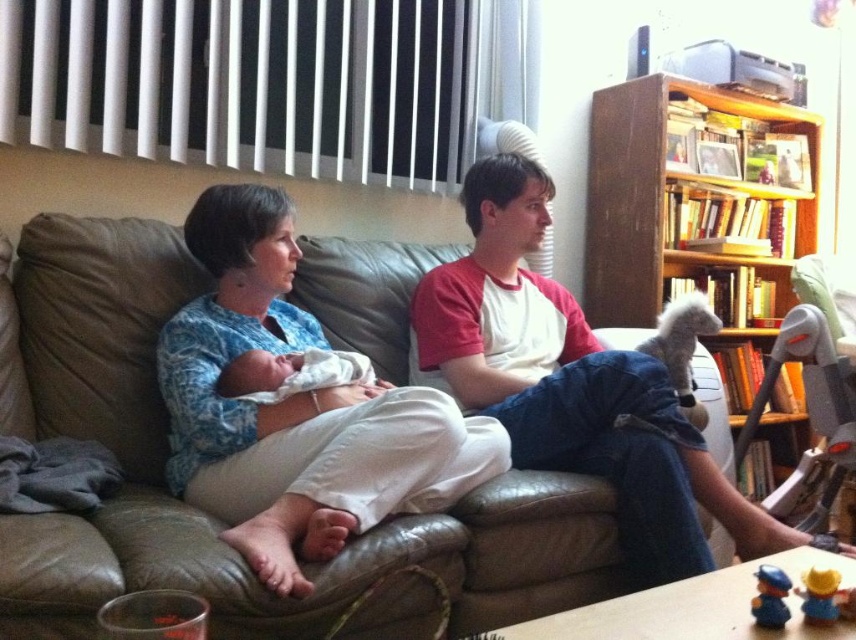
Between white plush toy at right and yellow matte toy at lower right, which one has less height?

yellow matte toy at lower right is shorter.

Which is more to the left, white plush toy at right or yellow matte toy at lower right?

Positioned to the left is yellow matte toy at lower right.

Is point (705, 314) in front of point (833, 580)?

No, (705, 314) is further to viewer.

I want to click on white plush toy at right, so click(682, 346).

Locate an element on the screen. The height and width of the screenshot is (640, 856). gray plastic robot at right is located at coordinates (809, 417).

Does point (827, 355) come farther from viewer compared to point (783, 621)?

That is True.

Is point (753, 435) farther from viewer compared to point (755, 624)?

Yes, point (753, 435) is farther from viewer.

Image resolution: width=856 pixels, height=640 pixels. Identify the location of gray plastic robot at right. (809, 417).

Which is above, wooden bookshelf at upper right or gray plastic robot at right?

wooden bookshelf at upper right is higher up.

Is wooden bookshelf at upper right below gray plastic robot at right?

No, wooden bookshelf at upper right is not below gray plastic robot at right.

This screenshot has height=640, width=856. Find the location of `wooden bookshelf at upper right`. wooden bookshelf at upper right is located at coordinates (687, 202).